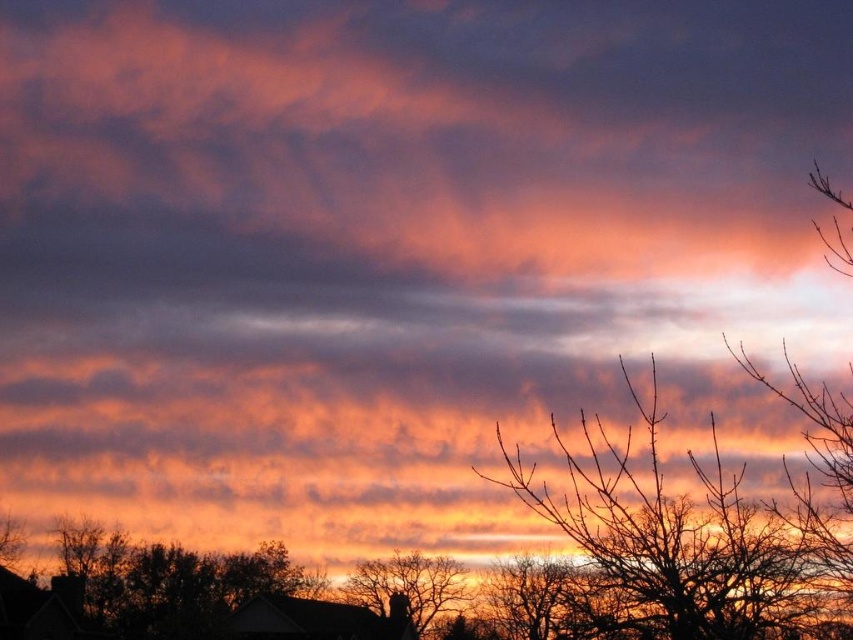
Is point (799, 541) positioned in front of point (383, 563)?

Yes.

Where is `smooth bark tree at center`? smooth bark tree at center is located at coordinates (711, 529).